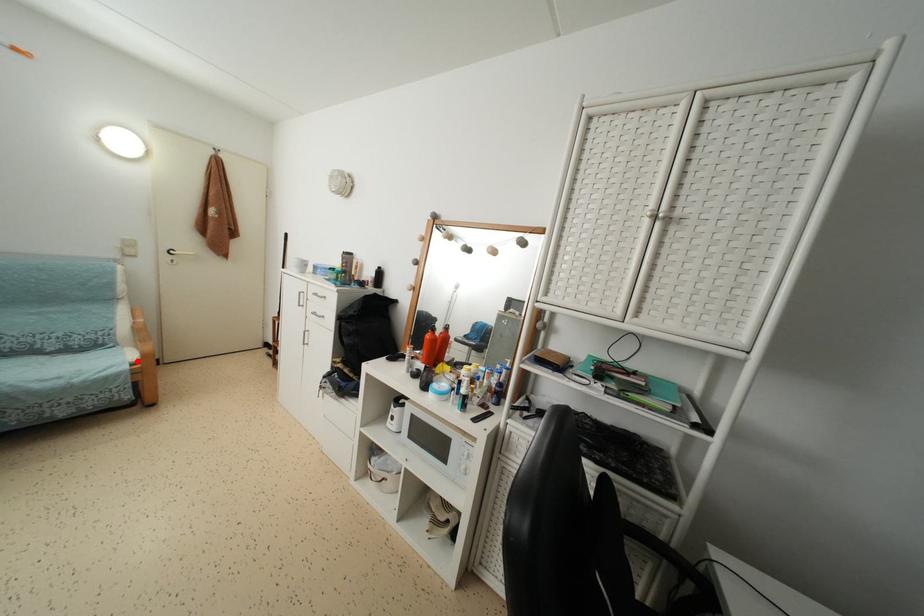
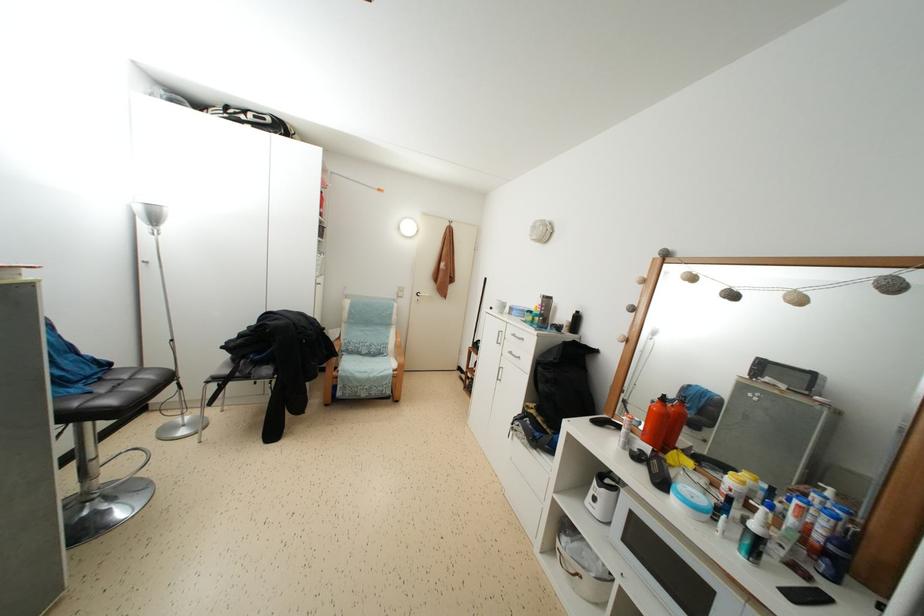
In the second image, find the point that corresponds to the highlighted location in the first image.

(398, 370)